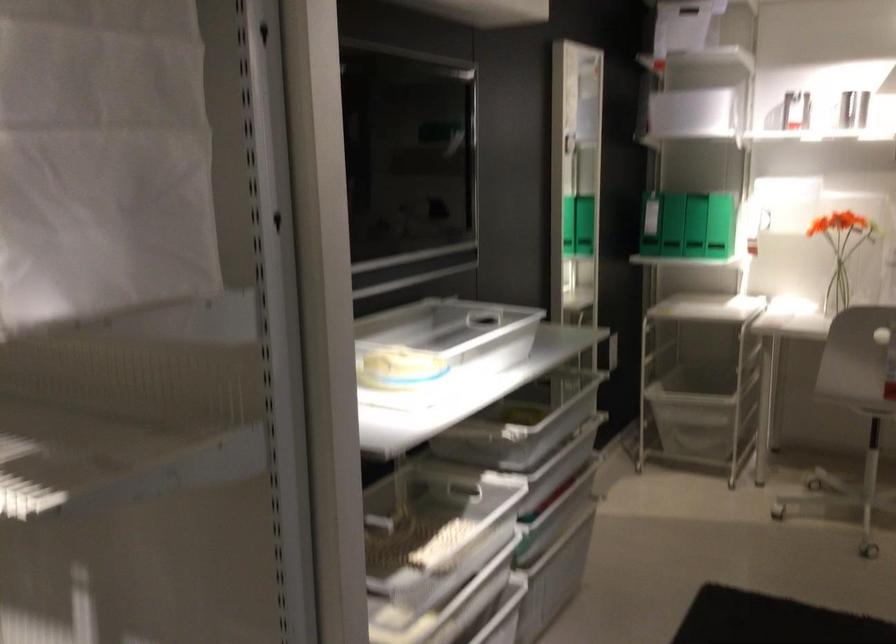
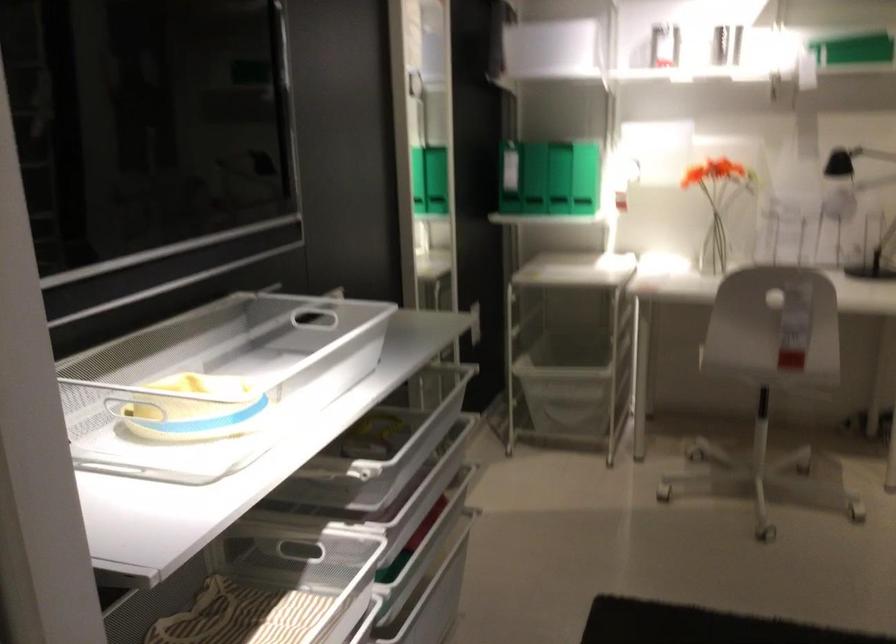
Find the pixel in the second image that matches (718,398) in the first image.

(566, 381)